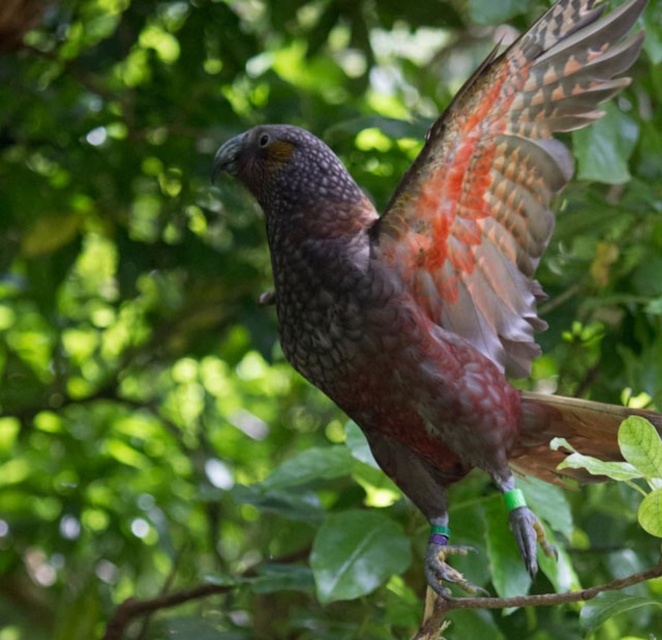
Question: Which of the following is the farthest from the observer?

Choices:
 (A) multicolored feathered wing at center
 (B) speckled feathered bird at center

Answer: (A)

Question: Among these points, which one is farthest from the camera?

Choices:
 (A) (481, 177)
 (B) (514, 236)

Answer: (B)

Question: Observing the image, what is the correct spatial positioning of speckled feathered bird at center in reference to multicolored feathered wing at center?

Choices:
 (A) below
 (B) above

Answer: (A)

Question: From the image, what is the correct spatial relationship of speckled feathered bird at center in relation to multicolored feathered wing at center?

Choices:
 (A) below
 (B) above

Answer: (A)

Question: Where is speckled feathered bird at center located in relation to multicolored feathered wing at center in the image?

Choices:
 (A) right
 (B) left

Answer: (B)